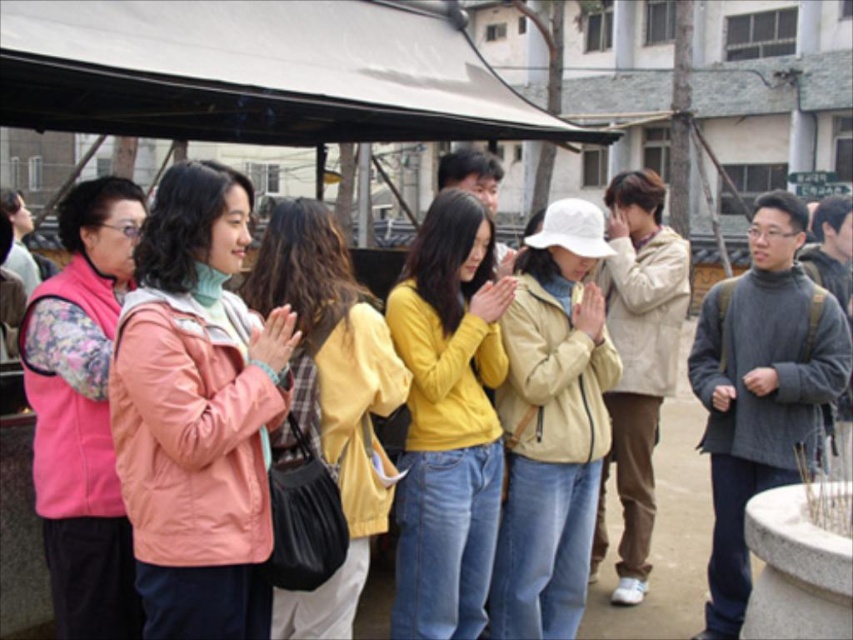
You are a photographer trying to capture both the peach matte jacket at center and the yellow matte sweater at center in a single frame. Which direction should you move your camera to ensure both are visible?

Since the peach matte jacket at center is to the left of the yellow matte sweater at center, you should move your camera slightly to the right to include both subjects in the frame.

You are standing at the entrance of the canopy and want to hand a document to the person wearing the peach matte jacket at center. If you can reach 3 meters, will you be able to reach them without moving?

The distance between you and the peach matte jacket at center is 9.87 feet, which is approximately 3 meters. Therefore, you can reach them without moving.

You are a photographer trying to capture a group photo of the people under the large black canopy. You notice the peach matte jacket at center and the beige matte jacket at center. Which jacket is blocking the view of the other?

The peach matte jacket at center is in front of the beige matte jacket at center, so it is blocking the view of the beige matte jacket at center.